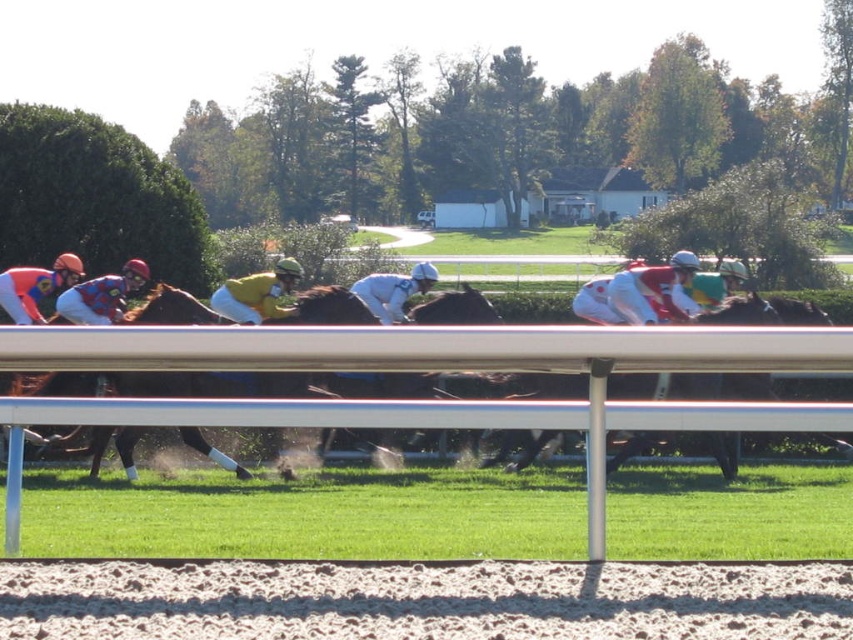
You are a photographer positioned at the center of the image. You want to capture a photo that includes both the brushed metal helmet at left and the jockeys in the midground. Based on their positions, where should you aim your camera relative to the current view?

The brushed metal helmet at left is located at point (102, 296) in the image. To include both the helmet and the jockeys in the midground, aim your camera slightly to the left and lower portion of the current view to ensure both elements are within the frame.

You are a spectator at the horse race and want to take a photo of both the brown glossy horse at center and the yellow matte jockey at center. Which one should you focus on first to ensure both are in frame?

The brown glossy horse at center is positioned on the right side of yellow matte jockey at center, so you should focus on the yellow matte jockey at center first to ensure both are in frame.

You are a spectator standing at the edge of the horse racing track. You see the yellow matte jockey at center and the matte orange helmet at left. Which one is more to the right side?

The yellow matte jockey at center is positioned on the right side of the matte orange helmet at left, so the yellow matte jockey at center is more to the right side.